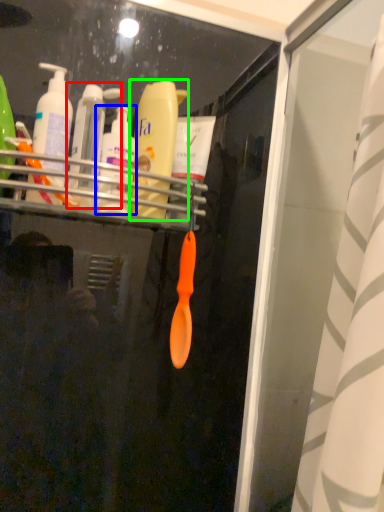
Question: Which object is the farthest from toiletry (highlighted by a red box)? Choose among these: toiletry (highlighted by a blue box) or bottle (highlighted by a green box).

Choices:
 (A) toiletry
 (B) bottle

Answer: (B)